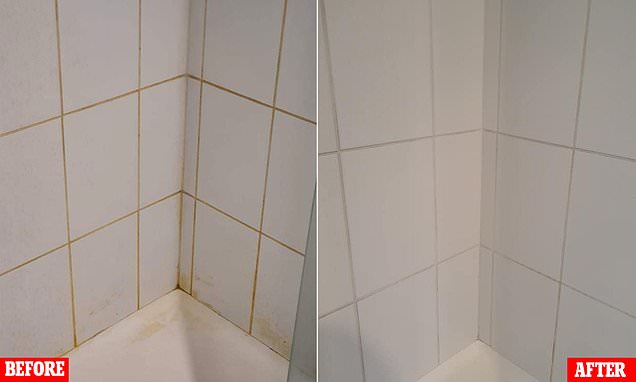
This screenshot has height=382, width=636. In order to click on clean white tile in this screenshot , I will do `click(397, 230)`.